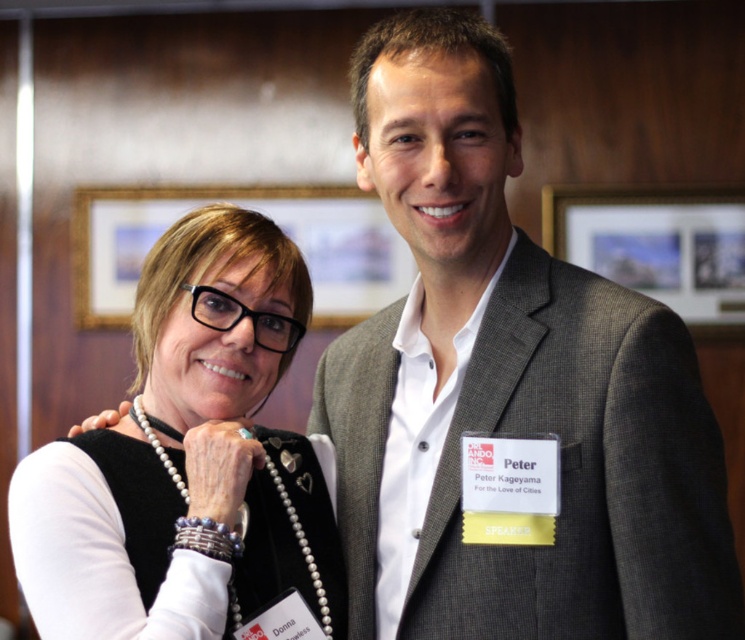
Can you confirm if gray wool suit at center is positioned below pearl necklace at center?

No, gray wool suit at center is not below pearl necklace at center.

Is gray wool suit at center positioned in front of pearl necklace at center?

No, it is behind pearl necklace at center.

Between point (548, 374) and point (197, 444), which one is positioned in front?

Point (548, 374)

You are a GUI agent. You are given a task and a screenshot of the screen. Output one action in this format:
    pyautogui.click(x=<x>, y=<y>)
    Task: Click on the gray wool suit at center
    This screenshot has height=640, width=745.
    Given the screenshot: What is the action you would take?
    pyautogui.click(x=510, y=385)